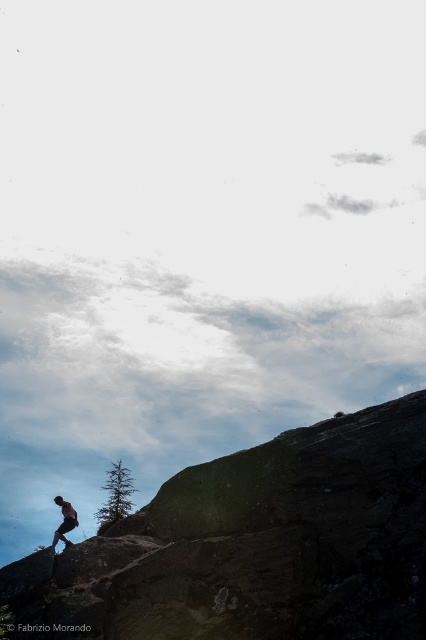
You are a hiker who wants to cross this rocky terrain. You notice the rough textured rock at lower right and the dark brown leather pants at lower left. Which object is bigger and might be easier to step on?

The rough textured rock at lower right is larger in size than the dark brown leather pants at lower left, so it might be easier to step on.

You are standing in the middle of the scene and want to move towards the dark brown leather pants at lower left. Which direction should you move to avoid the rough textured rock at lower right?

Since the rough textured rock at lower right is much taller than the dark brown leather pants at lower left, you should move towards the left to avoid the rock and reach the pants safely.

You are standing at the base of the rocky hillside and want to reach the rough textured rock at lower right. Given that the average walking pace is 3 feet per second, how many seconds will it take to reach the rock?

The rough textured rock at lower right is 79.47 feet away from viewer. At an average walking pace of 3 feet per second, it would take approximately 26.49 seconds to reach the rock.